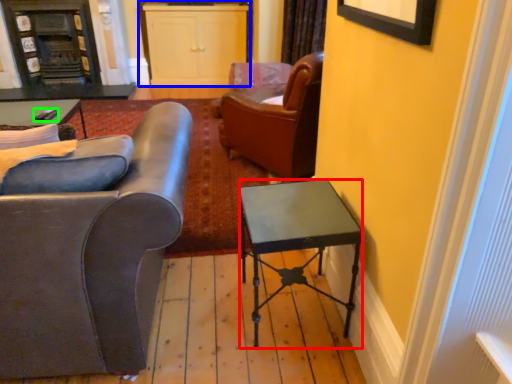
Question: Considering the real-world distances, which object is closest to desk (highlighted by a red box)? cabinetry (highlighted by a blue box) or remote control (highlighted by a green box).

Choices:
 (A) cabinetry
 (B) remote control

Answer: (B)